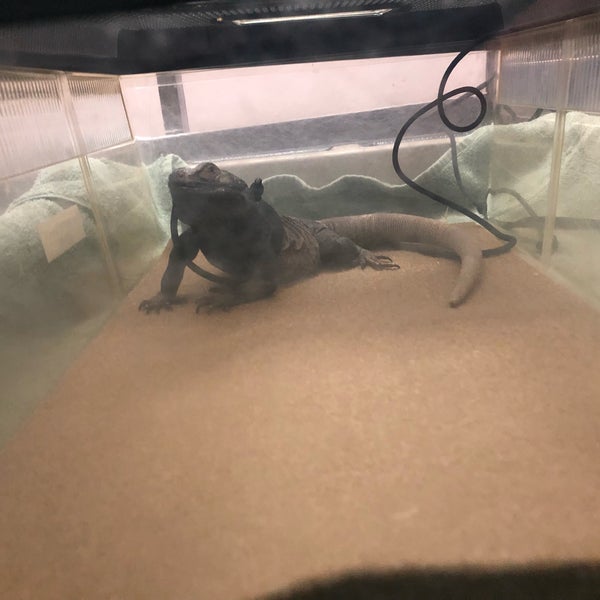
Identify the location of towel. The height and width of the screenshot is (600, 600). (77, 185).